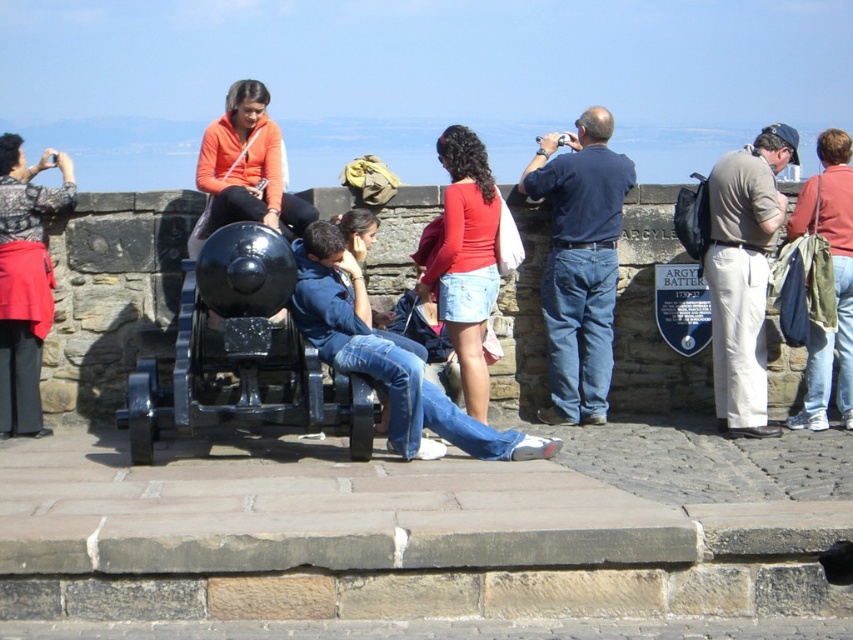
You are a photographer holding a matte black camera at left. You want to take a photo of the black polished cannon at center. Is the cannon positioned to the right of your camera?

Yes, the black polished cannon at center is positioned to the right of the matte black camera at left, so you can take the photo by aiming your camera to the right.

You are a photographer trying to capture a detailed shot of the cannon. You have a matte black camera at left and khaki cotton pants at right in your frame. Which object is more suitable to use as a reference for depth of field adjustment?

The matte black camera at left is thicker than the khaki cotton pants at right, so it would provide a better reference for depth of field adjustment because thicker objects can help establish depth more effectively in the scene.

You are standing at point [9,339] and want to walk to the cannon. Is the point [233,256] between you and the cannon?

Yes, the point [233,256] is between you and the cannon because it is in front of point [9,339], which is your current position.